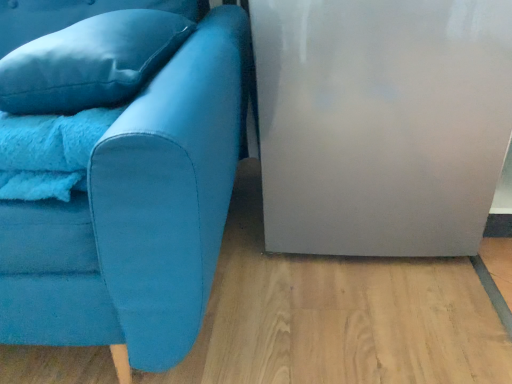
Question: Considering the positions of point (93, 279) and point (143, 39), is point (93, 279) closer or farther from the camera than point (143, 39)?

Choices:
 (A) closer
 (B) farther

Answer: (A)

Question: Which is correct: matte blue couch at left is inside satin blue pillow at upper left, or outside of it?

Choices:
 (A) outside
 (B) inside

Answer: (A)

Question: In the image, is matte blue couch at left positioned in front of or behind satin blue pillow at upper left?

Choices:
 (A) front
 (B) behind

Answer: (A)

Question: From the image's perspective, relative to matte blue couch at left, is satin blue pillow at upper left above or below?

Choices:
 (A) below
 (B) above

Answer: (B)

Question: From a real-world perspective, is satin blue pillow at upper left physically located above or below matte blue couch at left?

Choices:
 (A) above
 (B) below

Answer: (A)

Question: In terms of width, does satin blue pillow at upper left look wider or thinner when compared to matte blue couch at left?

Choices:
 (A) thin
 (B) wide

Answer: (A)

Question: Considering their positions, is satin blue pillow at upper left located in front of or behind matte blue couch at left?

Choices:
 (A) front
 (B) behind

Answer: (B)